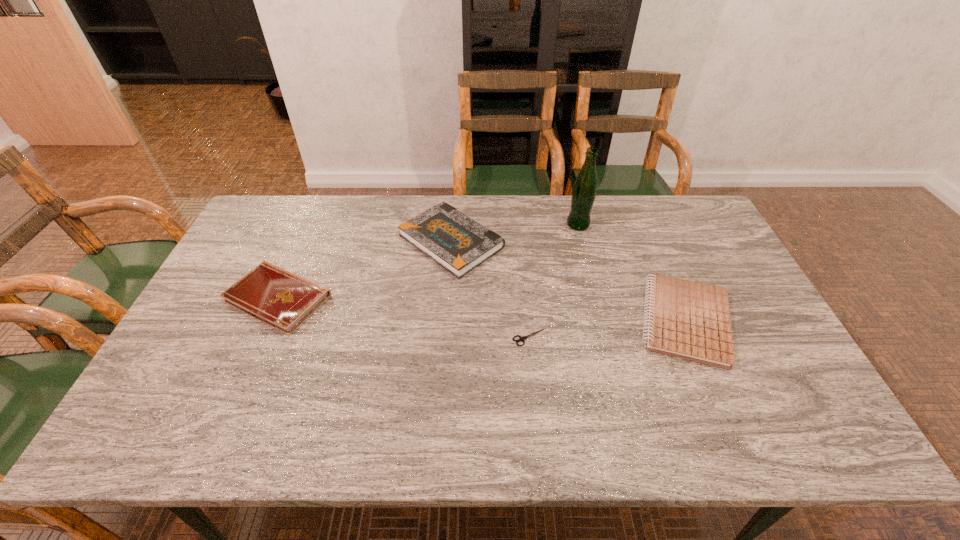
Identify the location of free space at the right edge of the desktop. Image resolution: width=960 pixels, height=540 pixels. (766, 321).

The width and height of the screenshot is (960, 540). Identify the location of vacant space at the far left corner of the desktop. (267, 238).

I want to click on free space between the tallest object and the leftmost object, so click(428, 261).

Locate an element on the screen. Image resolution: width=960 pixels, height=540 pixels. vacant space that's between the second tallest object and the second object from right to left is located at coordinates (515, 233).

Where is `vacant space in between the tallest object and the fourth shortest object`? The width and height of the screenshot is (960, 540). vacant space in between the tallest object and the fourth shortest object is located at coordinates (515, 233).

Where is `free area in between the third object from left to right and the second object from left to right`? The width and height of the screenshot is (960, 540). free area in between the third object from left to right and the second object from left to right is located at coordinates (491, 289).

The image size is (960, 540). Find the location of `vacant region between the leftmost object and the rightmost object`. vacant region between the leftmost object and the rightmost object is located at coordinates (482, 309).

You are a GUI agent. You are given a task and a screenshot of the screen. Output one action in this format:
    pyautogui.click(x=<x>, y=<y>)
    Task: Click on the vacant area that lies between the leftmost notebook and the tallest notebook
    The image size is (960, 540).
    Given the screenshot: What is the action you would take?
    pyautogui.click(x=365, y=270)

Find the location of a particular element. empty space between the shortest object and the rightmost object is located at coordinates (608, 329).

Where is `vacant area between the second notebook from left to right and the leftmost notebook`? Image resolution: width=960 pixels, height=540 pixels. vacant area between the second notebook from left to right and the leftmost notebook is located at coordinates (365, 270).